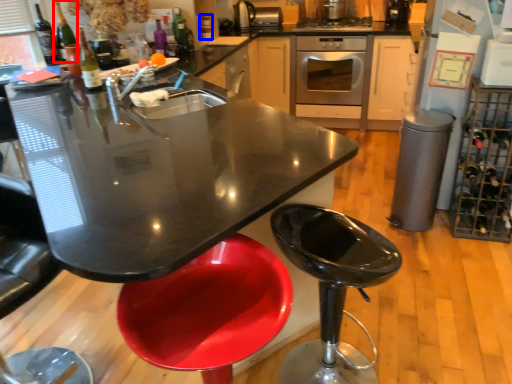
Question: Which object appears closest to the camera in this image, wine bottle (highlighted by a red box) or bottle (highlighted by a blue box)?

Choices:
 (A) wine bottle
 (B) bottle

Answer: (A)